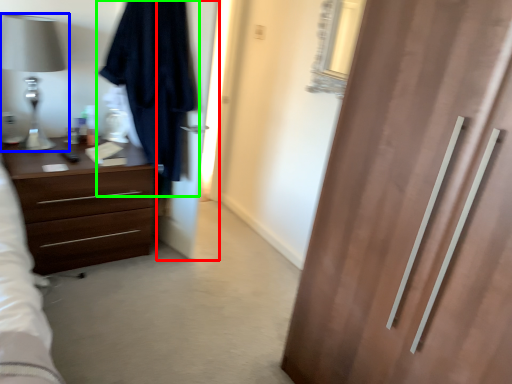
Question: Which is farther away from screen door (highlighted by a red box)? table lamp (highlighted by a blue box) or robe (highlighted by a green box)?

Choices:
 (A) table lamp
 (B) robe

Answer: (A)